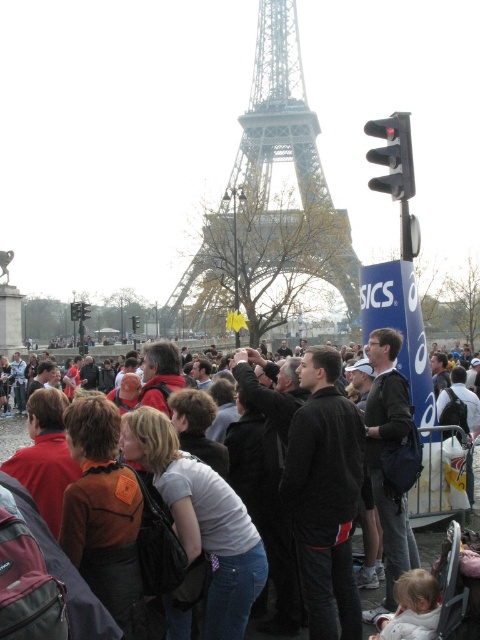
You are standing at the point labeled as point (268, 204) in the image. Looking around, you see the metallic silver Eiffel Tower at center. What is the nearest object to you?

The nearest object to you is the metallic silver Eiffel Tower at center, as you are standing at the point corresponding to it.

You are a photographer standing in the crowd at the Eiffel Tower. You want to take a photo that includes both the metallic silver eiffel tower at center and the dark gray jacket at center. Which object should you zoom in on to ensure both fit in the frame?

You should zoom out to ensure both the metallic silver eiffel tower at center and the dark gray jacket at center fit in the frame, since the metallic silver eiffel tower at center is larger than the dark gray jacket at center.

You are a photographer trying to capture the Eiffel Tower in the background while focusing on a person wearing the dark gray jacket at center. Based on their positions, will the metallic silver Eiffel Tower at center fit entirely within the camera frame if you zoom out slightly?

The metallic silver Eiffel Tower at center is narrower than the dark gray jacket at center, so zooming out slightly should allow the Eiffel Tower to fit within the frame while still keeping the jacket in focus.